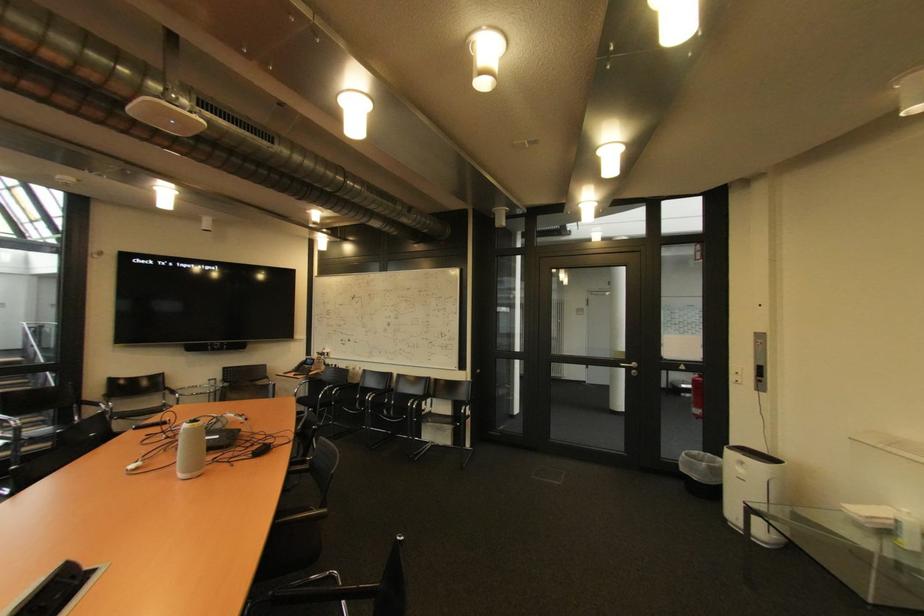
The location [190,450] corresponds to which object?

It corresponds to the white conference speaker in the image.